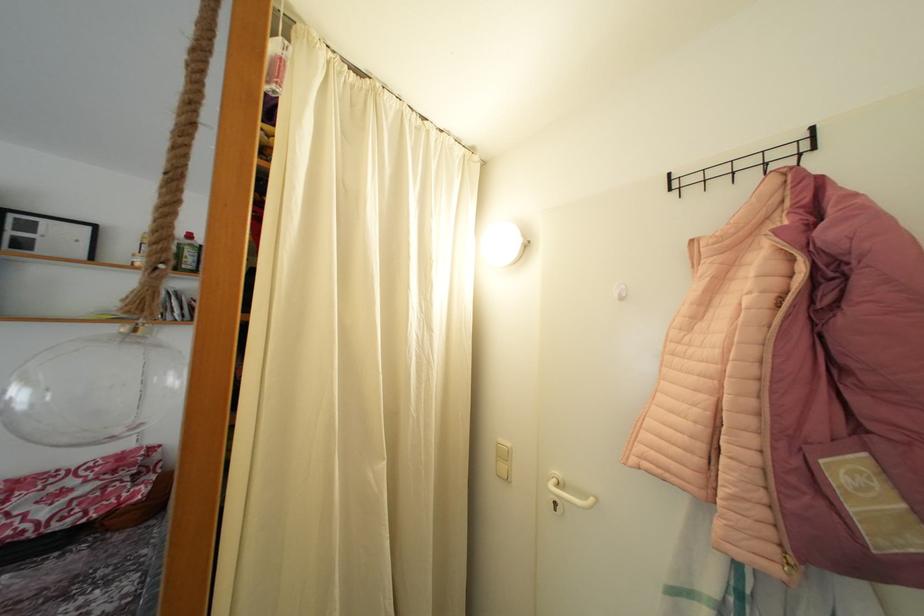
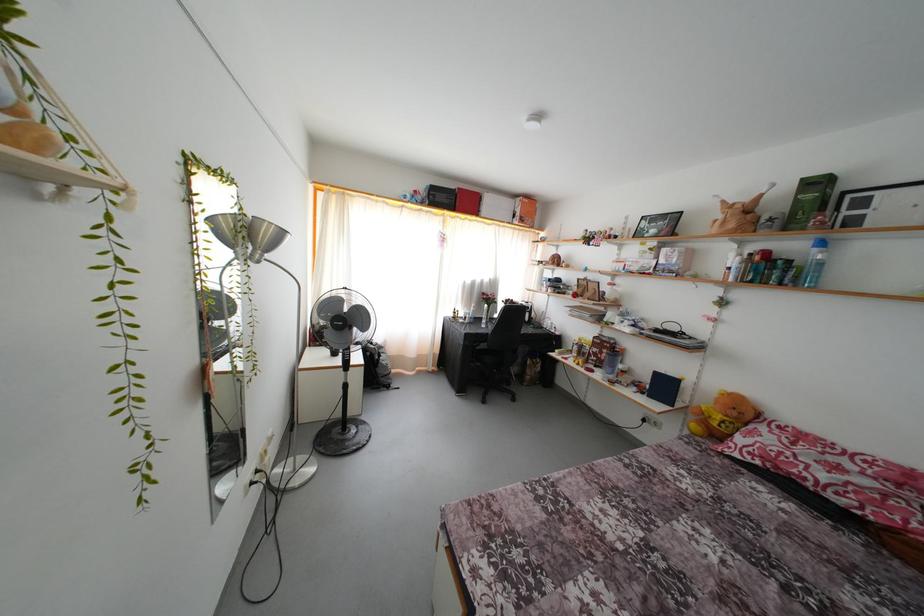
Question: The camera is either moving clockwise (left) or counter-clockwise (right) around the object. The first image is from the beginning of the video and the second image is from the end. Is the camera moving left or right when shooting the video?

Choices:
 (A) Left
 (B) Right

Answer: (B)